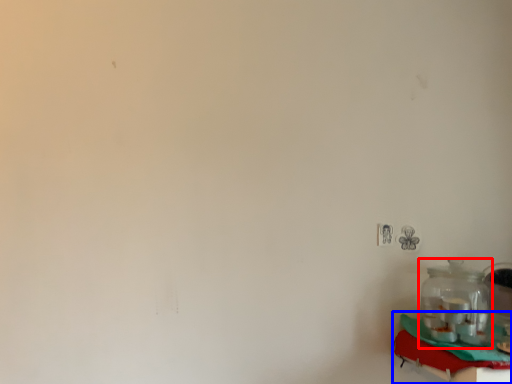
Question: Which point is closer to the camera, bottle (highlighted by a red box) or table (highlighted by a blue box)?

Choices:
 (A) bottle
 (B) table

Answer: (B)